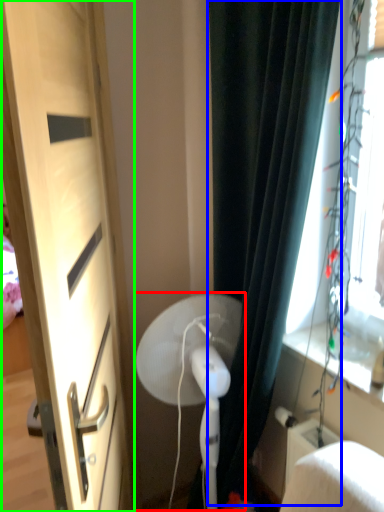
Question: Which object is positioned farthest from fan (highlighted by a red box)? Select from curtain (highlighted by a blue box) and door (highlighted by a green box).

Choices:
 (A) curtain
 (B) door

Answer: (B)